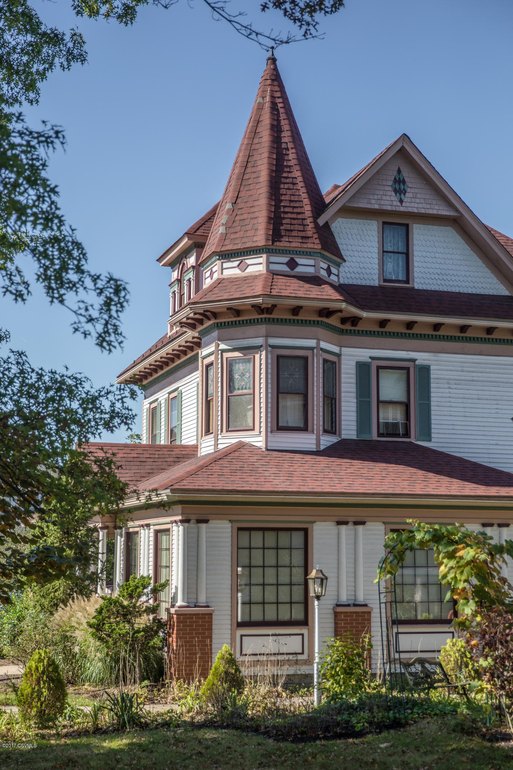
Image resolution: width=513 pixels, height=770 pixels. In order to click on one of two adjacent pillars in this screenshot , I will do `click(341, 577)`.